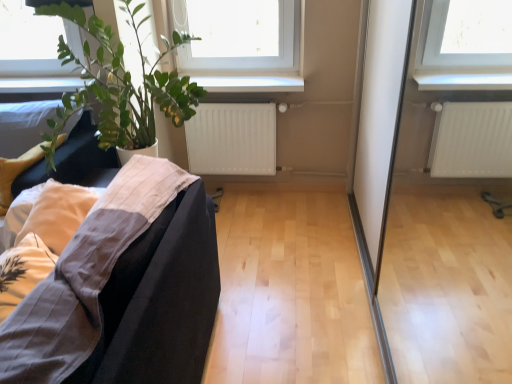
Question: Can you confirm if white glossy window sill at upper center is shorter than green leafy plant at left?

Choices:
 (A) no
 (B) yes

Answer: (B)

Question: Is white glossy window sill at upper center at the left side of green leafy plant at left?

Choices:
 (A) yes
 (B) no

Answer: (B)

Question: From a real-world perspective, is white glossy window sill at upper center under green leafy plant at left?

Choices:
 (A) yes
 (B) no

Answer: (A)

Question: Does white glossy window sill at upper center have a lesser width compared to green leafy plant at left?

Choices:
 (A) no
 (B) yes

Answer: (B)

Question: Does white glossy window sill at upper center lie behind green leafy plant at left?

Choices:
 (A) yes
 (B) no

Answer: (A)

Question: Would you say white glossy window sill at upper center contains green leafy plant at left?

Choices:
 (A) yes
 (B) no

Answer: (B)

Question: Considering the relative sizes of white matte radiator at center and white glossy window sill at upper center in the image provided, is white matte radiator at center wider than white glossy window sill at upper center?

Choices:
 (A) no
 (B) yes

Answer: (A)

Question: From a real-world perspective, is white matte radiator at center physically below white glossy window sill at upper center?

Choices:
 (A) yes
 (B) no

Answer: (A)

Question: From the image's perspective, is white matte radiator at center located beneath white glossy window sill at upper center?

Choices:
 (A) yes
 (B) no

Answer: (A)

Question: Can you confirm if white matte radiator at center is positioned to the left of white glossy window sill at upper center?

Choices:
 (A) yes
 (B) no

Answer: (A)

Question: Is white matte radiator at center touching white glossy window sill at upper center?

Choices:
 (A) no
 (B) yes

Answer: (A)

Question: Does white matte radiator at center turn towards white glossy window sill at upper center?

Choices:
 (A) yes
 (B) no

Answer: (B)

Question: Is white matte radiator at center completely or partially inside white glossy window sill at upper center?

Choices:
 (A) no
 (B) yes

Answer: (A)